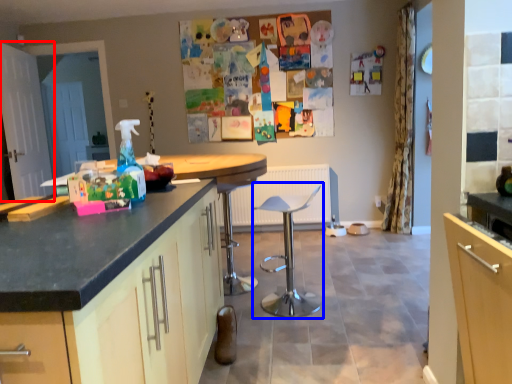
Question: Which of the following is the closest to the observer, screen door (highlighted by a red box) or swivel chair (highlighted by a blue box)?

Choices:
 (A) screen door
 (B) swivel chair

Answer: (B)